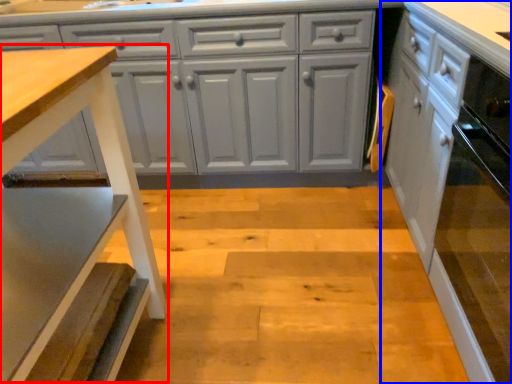
Question: Which point is further to the camera, step stool (highlighted by a red box) or cabinetry (highlighted by a blue box)?

Choices:
 (A) step stool
 (B) cabinetry

Answer: (B)